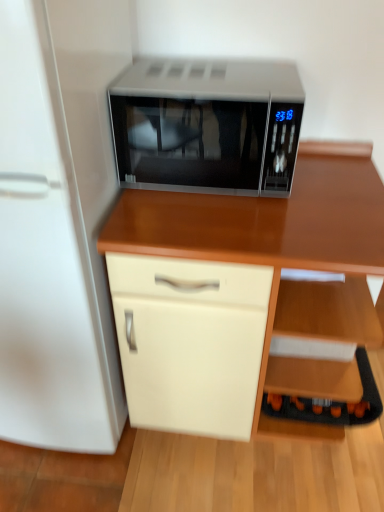
Find the location of a particular element. The width and height of the screenshot is (384, 512). unoccupied region to the right of sleek silver microwave at center is located at coordinates (335, 174).